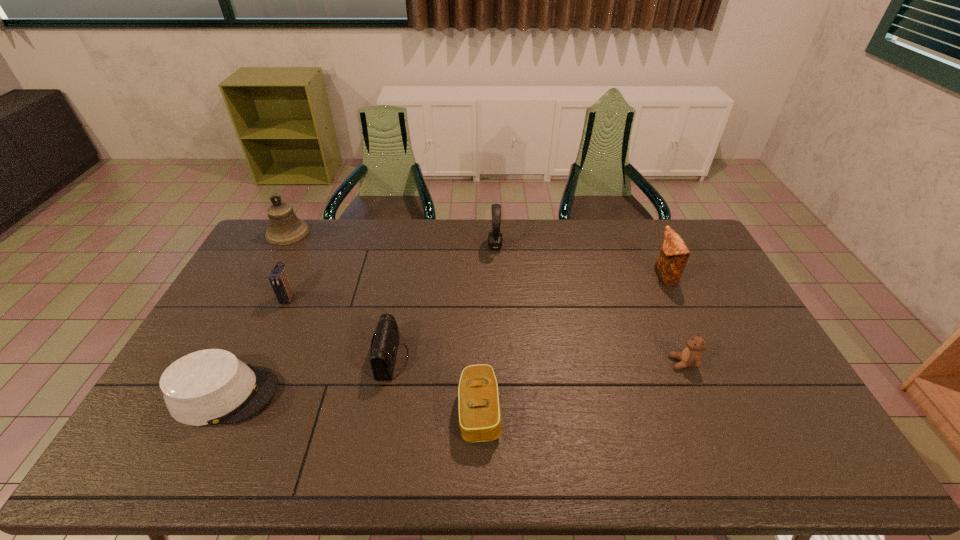
Image resolution: width=960 pixels, height=540 pixels. I want to click on empty location between the second clutch bag from left to right and the tallest clutch bag, so click(528, 318).

Where is `unoccupied area between the headset and the hat`? This screenshot has height=540, width=960. unoccupied area between the headset and the hat is located at coordinates (360, 320).

I want to click on free point between the third clutch bag from left to right and the second clutch bag from left to right, so click(436, 385).

Locate an element on the screen. Image resolution: width=960 pixels, height=540 pixels. free space between the tallest clutch bag and the hat is located at coordinates (444, 335).

You are a GUI agent. You are given a task and a screenshot of the screen. Output one action in this format:
    pyautogui.click(x=<x>, y=<y>)
    Task: Click on the vacant point located between the teddy bear and the fifth shortest object
    
    Given the screenshot: What is the action you would take?
    pyautogui.click(x=486, y=330)

At what (x,y) coordinates should I click in order to perform the action: click on object that is the seventh closest one to the rightmost clutch bag. Please return your answer as a coordinate pair (x, y). This screenshot has width=960, height=540. Looking at the image, I should click on (285, 228).

Point out which object is positioned as the sixth nearest to the tallest clutch bag. Please provide its 2D coordinates. Your answer should be formatted as a tuple, i.e. [(x, y)], where the tuple contains the x and y coordinates of a point satisfying the conditions above.

[(278, 278)]

I want to click on the third closest clutch bag to the hat, so click(x=479, y=406).

Identify which clutch bag is located as the nearest to the fourth object from left to right. Please provide its 2D coordinates. Your answer should be formatted as a tuple, i.e. [(x, y)], where the tuple contains the x and y coordinates of a point satisfying the conditions above.

[(479, 406)]

At what (x,y) coordinates should I click in order to perform the action: click on vacant region that satisfies the following two spatial constraints: 1. with the zip open on the fourth tallest object; 2. on the front-facing side of the hat. Please return your answer as a coordinate pair (x, y). Image resolution: width=960 pixels, height=540 pixels. Looking at the image, I should click on (244, 394).